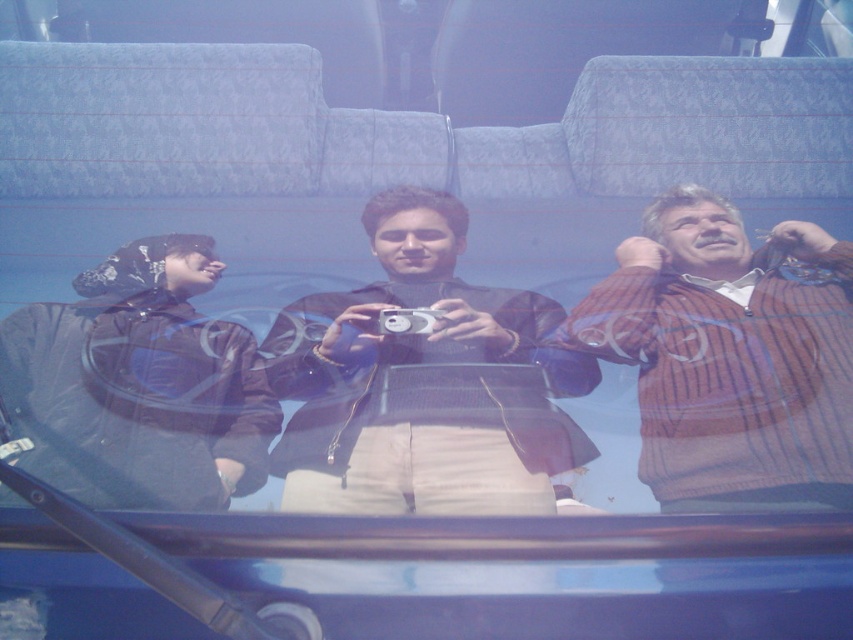
Does black matte jacket at center lie in front of black matte jacket at left?

No, it is not.

Between black matte jacket at center and black matte jacket at left, which one has less height?

With less height is black matte jacket at left.

Measure the distance between point (283, 337) and camera.

1.51 meters

I want to click on black matte jacket at center, so click(416, 362).

Who is positioned more to the right, striped sweater at right or silver metallic camera at center?

From the viewer's perspective, striped sweater at right appears more on the right side.

Is point (764, 380) closer to camera compared to point (407, 320)?

Yes, it is in front of point (407, 320).

Locate an element on the screen. The width and height of the screenshot is (853, 640). striped sweater at right is located at coordinates (729, 358).

Which of these two, striped sweater at right or black matte jacket at center, stands taller?

black matte jacket at center

Is striped sweater at right bigger than black matte jacket at center?

Incorrect, striped sweater at right is not larger than black matte jacket at center.

Where is `striped sweater at right`? This screenshot has height=640, width=853. striped sweater at right is located at coordinates (729, 358).

Locate an element on the screen. The width and height of the screenshot is (853, 640). striped sweater at right is located at coordinates (729, 358).